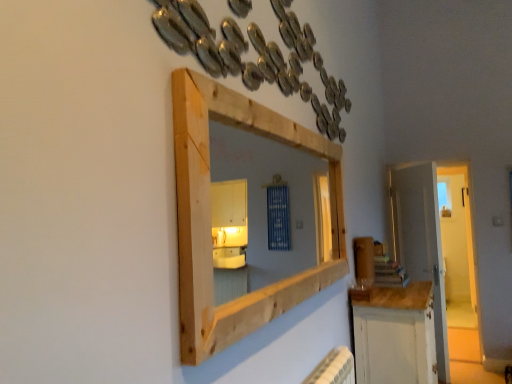
Describe the element at coordinates (421, 242) in the screenshot. I see `white wooden door at right` at that location.

This screenshot has height=384, width=512. I want to click on white wooden door at right, so click(x=421, y=242).

From the picture: Which is more to the left, natural wood medicine cabinet at upper center or white painted wood cabinet at lower right?

natural wood medicine cabinet at upper center.

Is natural wood medicine cabinet at upper center aimed at white painted wood cabinet at lower right?

No, natural wood medicine cabinet at upper center is not facing towards white painted wood cabinet at lower right.

Are natural wood medicine cabinet at upper center and white painted wood cabinet at lower right beside each other?

There is a gap between natural wood medicine cabinet at upper center and white painted wood cabinet at lower right.

Between natural wood medicine cabinet at upper center and white painted wood cabinet at lower right, which one has larger width?

white painted wood cabinet at lower right.

Does point (409, 354) appear closer or farther from the camera than point (209, 351)?

Point (409, 354).

Does white painted wood cabinet at lower right have a greater height compared to natural wood medicine cabinet at upper center?

Correct, white painted wood cabinet at lower right is much taller as natural wood medicine cabinet at upper center.

Is the depth of white painted wood cabinet at lower right less than that of natural wood medicine cabinet at upper center?

No, it is not.

Who is taller, natural wood medicine cabinet at upper center or white wooden door at right?

white wooden door at right is taller.

Image resolution: width=512 pixels, height=384 pixels. Identify the location of door on the right of natural wood medicine cabinet at upper center. (421, 242).

Is natural wood medicine cabinet at upper center wider than white wooden door at right?

Yes.

From the image's perspective, is natural wood medicine cabinet at upper center beneath white wooden door at right?

Incorrect, from the image's perspective, natural wood medicine cabinet at upper center is higher than white wooden door at right.

In the image, there is a natural wood medicine cabinet at upper center. At what (x,y) coordinates should I click in order to perform the action: click on door below it (from a real-world perspective). Please return your answer as a coordinate pair (x, y). Image resolution: width=512 pixels, height=384 pixels. Looking at the image, I should click on (421, 242).

Considering the relative sizes of white wooden door at right and natural wood medicine cabinet at upper center in the image provided, is white wooden door at right smaller than natural wood medicine cabinet at upper center?

Actually, white wooden door at right might be larger than natural wood medicine cabinet at upper center.

Between white wooden door at right and natural wood medicine cabinet at upper center, which one is positioned in front?

natural wood medicine cabinet at upper center.

Can you confirm if white painted wood cabinet at lower right is smaller than white wooden door at right?

No, white painted wood cabinet at lower right is not smaller than white wooden door at right.

Which of these two, white painted wood cabinet at lower right or white wooden door at right, is wider?

With larger width is white painted wood cabinet at lower right.

Which is closer to the camera, (386,303) or (399,260)?

Point (386,303).

Locate an element on the screen. This screenshot has width=512, height=384. door behind the white painted wood cabinet at lower right is located at coordinates (421, 242).

Can white painted wood cabinet at lower right be found inside white wooden door at right?

No, white painted wood cabinet at lower right is not inside white wooden door at right.

From the picture: Which of these two, white wooden door at right or white painted wood cabinet at lower right, is smaller?

With smaller size is white wooden door at right.

Locate an element on the screen. This screenshot has width=512, height=384. cabinetry behind the natural wood medicine cabinet at upper center is located at coordinates (394, 334).

This screenshot has width=512, height=384. I want to click on medicine cabinet that is on the left side of white painted wood cabinet at lower right, so click(209, 216).

Looking at the image, which one is located further to natural wood medicine cabinet at upper center, white painted wood cabinet at lower right or white wooden door at right?

white wooden door at right.

Estimate the real-world distances between objects in this image. Which object is closer to white painted wood cabinet at lower right, natural wood medicine cabinet at upper center or white wooden door at right?

The object closer to white painted wood cabinet at lower right is natural wood medicine cabinet at upper center.

When comparing their distances from white wooden door at right, does natural wood medicine cabinet at upper center or white painted wood cabinet at lower right seem closer?

white painted wood cabinet at lower right.

From the image, which object appears to be nearer to white painted wood cabinet at lower right, white wooden door at right or natural wood medicine cabinet at upper center?

natural wood medicine cabinet at upper center lies closer to white painted wood cabinet at lower right than the other object.

Estimate the real-world distances between objects in this image. Which object is further from white wooden door at right, white painted wood cabinet at lower right or natural wood medicine cabinet at upper center?

natural wood medicine cabinet at upper center.

Considering their positions, is white wooden door at right positioned closer to natural wood medicine cabinet at upper center than white painted wood cabinet at lower right?

white painted wood cabinet at lower right is positioned closer to the anchor natural wood medicine cabinet at upper center.

The image size is (512, 384). I want to click on cabinetry between natural wood medicine cabinet at upper center and white wooden door at right along the z-axis, so pyautogui.click(x=394, y=334).